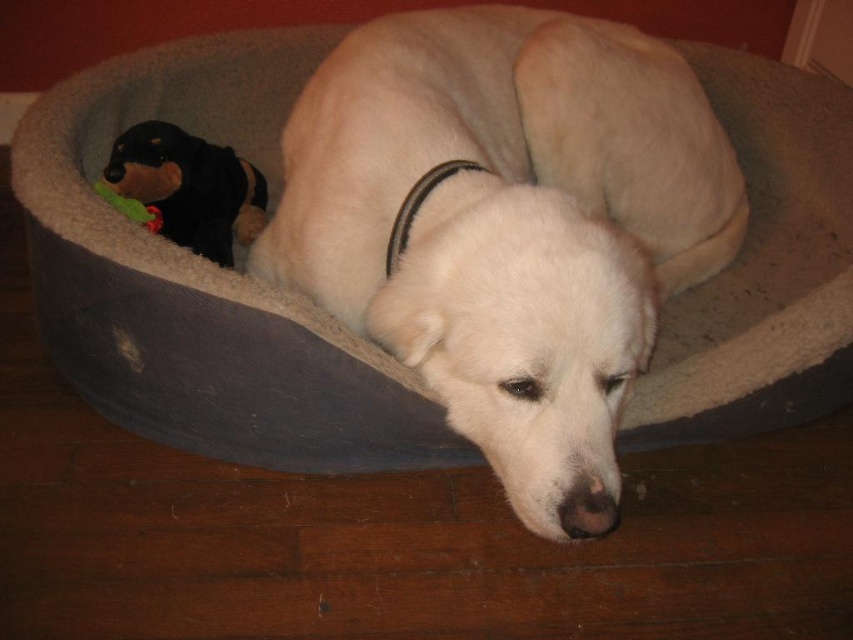
Looking at the scene, which object is wider between the white fur dog at center and the green plush toy at left?

The white fur dog at center is wider than the green plush toy at left.